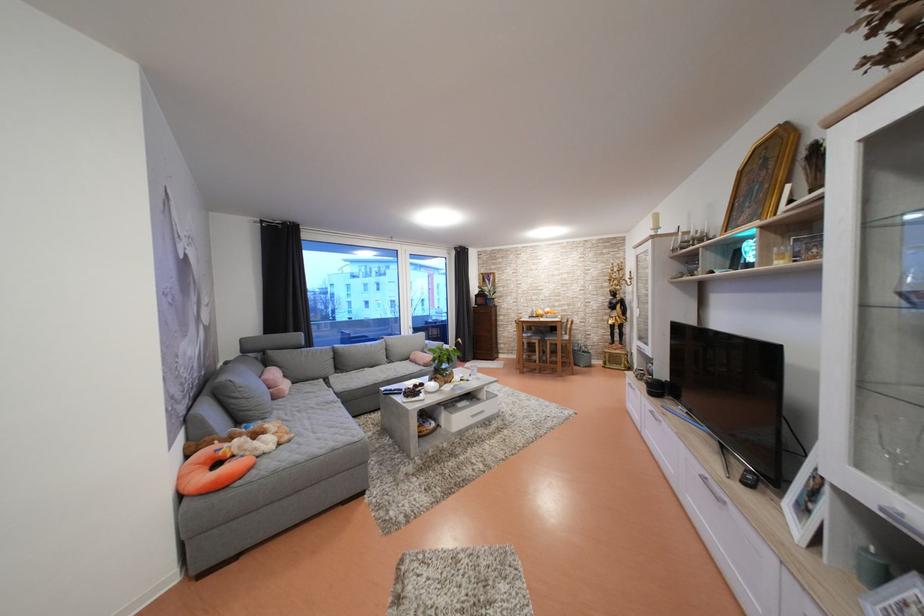
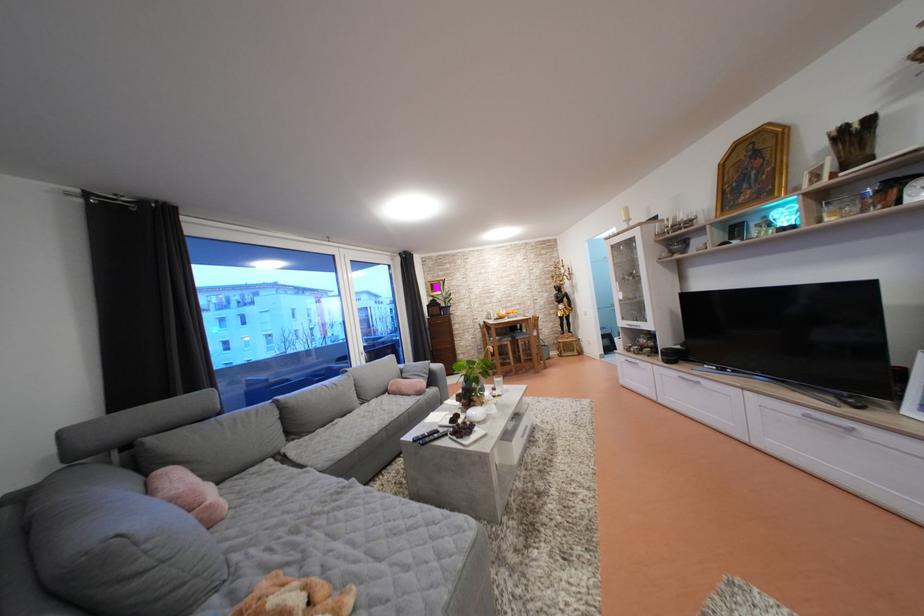
Where in the second image is the point corresponding to pixel 512 349 from the first image?

(470, 359)